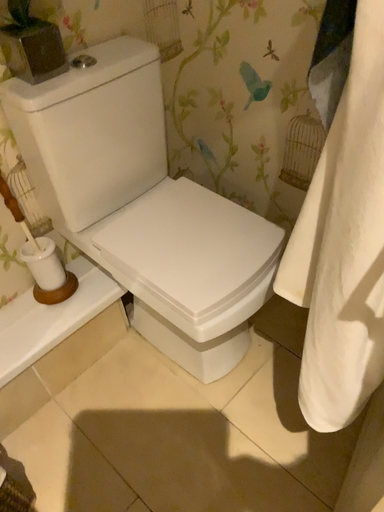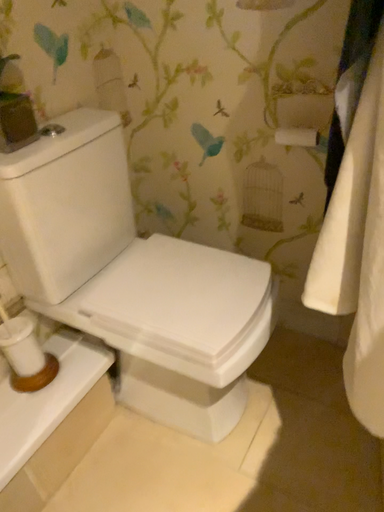
Question: How did the camera likely rotate when shooting the video?

Choices:
 (A) rotated downward
 (B) rotated upward

Answer: (B)